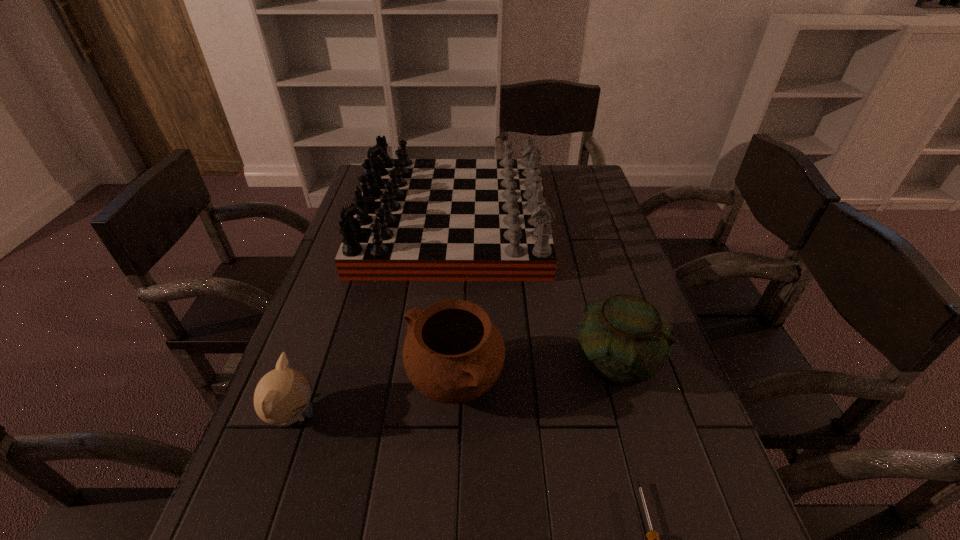
Where is `kitten present at the left edge`? The height and width of the screenshot is (540, 960). kitten present at the left edge is located at coordinates (282, 396).

This screenshot has height=540, width=960. Identify the location of object located at the right edge. (624, 340).

Image resolution: width=960 pixels, height=540 pixels. I want to click on object that is at the far left corner, so click(416, 219).

In the image, there is a desktop. At what (x,y) coordinates should I click in order to perform the action: click on vacant space at the far edge. Please return your answer as a coordinate pair (x, y). Looking at the image, I should click on (552, 186).

The image size is (960, 540). In the image, there is a desktop. What are the coordinates of `vacant space at the left edge` in the screenshot? It's located at (319, 319).

Where is `vacant region at the right edge`? vacant region at the right edge is located at coordinates (588, 203).

You are a GUI agent. You are given a task and a screenshot of the screen. Output one action in this format:
    pyautogui.click(x=<x>, y=<y>)
    Task: Click on the empty space that is in between the farthest object and the fourth tallest object
    This screenshot has width=960, height=540.
    Given the screenshot: What is the action you would take?
    pyautogui.click(x=372, y=319)

Locate an element on the screen. Image resolution: width=960 pixels, height=540 pixels. empty location between the gameboard and the fourth tallest object is located at coordinates (372, 319).

This screenshot has height=540, width=960. Identify the location of vacant region between the right pottery and the left pottery. (536, 373).

You are a GUI agent. You are given a task and a screenshot of the screen. Output one action in this format:
    pyautogui.click(x=<x>, y=<y>)
    Task: Click on the vacant area between the kitten and the left pottery
    
    Given the screenshot: What is the action you would take?
    pyautogui.click(x=373, y=400)